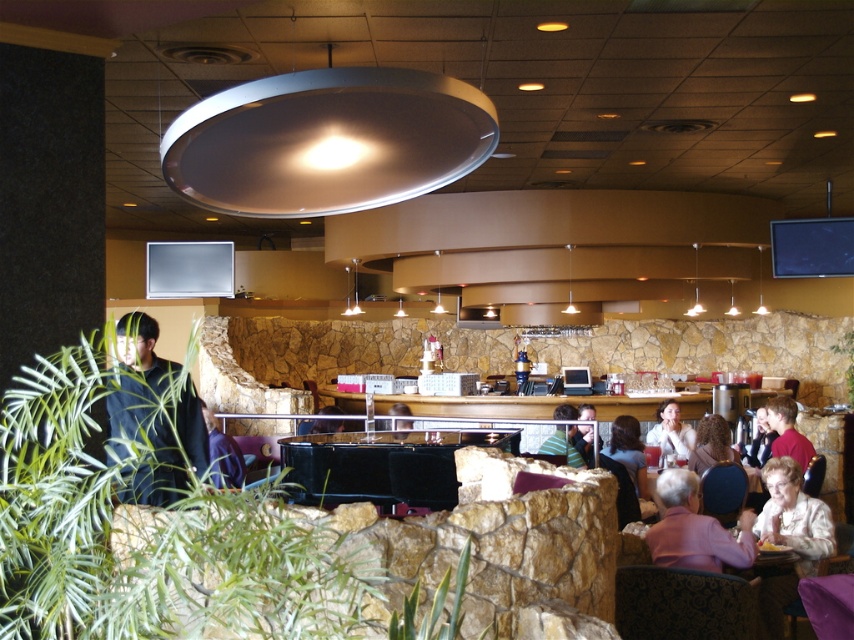
Question: Can you confirm if black glossy table at center is positioned below red shirt at right?

Choices:
 (A) yes
 (B) no

Answer: (B)

Question: Which is nearer to the red shirt at right?

Choices:
 (A) smooth brown hair at center
 (B) dark blue shirt at center
 (C) pink fabric chair at lower right
 (D) blurred hair at center

Answer: (D)

Question: Is light beige sweater at lower right smaller than red shirt at right?

Choices:
 (A) yes
 (B) no

Answer: (B)

Question: Among these objects, which one is farthest from the camera?

Choices:
 (A) smooth brown hair at center
 (B) blurred hair at center

Answer: (A)

Question: Which object is positioned closest to the striped shirt at center?

Choices:
 (A) blonde hair at center
 (B) dark brown hair at center

Answer: (B)

Question: Can you confirm if black glossy table at center is smaller than light beige sweater at lower right?

Choices:
 (A) yes
 (B) no

Answer: (B)